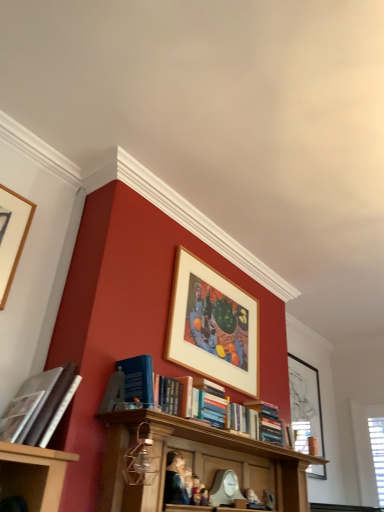
Question: Considering the relative positions of black matte picture frame at upper right, which ranks as the third picture frame in left-to-right order, and smooth plastic figurine at center, positioned as the 2th person in left-to-right order, in the image provided, is black matte picture frame at upper right, which ranks as the third picture frame in left-to-right order, to the right of smooth plastic figurine at center, positioned as the 2th person in left-to-right order, from the viewer's perspective?

Choices:
 (A) no
 (B) yes

Answer: (B)

Question: Is black matte picture frame at upper right, which is counted as the 1th picture frame, starting from the back, turned away from smooth plastic figurine at center, which appears as the first person when viewed from the right?

Choices:
 (A) yes
 (B) no

Answer: (B)

Question: Is black matte picture frame at upper right, which ranks as the 1th picture frame in right-to-left order, bigger than smooth plastic figurine at center, which appears as the first person when viewed from the right?

Choices:
 (A) yes
 (B) no

Answer: (A)

Question: From the image's perspective, is black matte picture frame at upper right, which ranks as the third picture frame in left-to-right order, located beneath smooth plastic figurine at center, positioned as the 2th person in left-to-right order?

Choices:
 (A) no
 (B) yes

Answer: (B)

Question: From the image's perspective, is black matte picture frame at upper right, which is counted as the 1th picture frame, starting from the back, on top of smooth plastic figurine at center, which appears as the first person when viewed from the right?

Choices:
 (A) yes
 (B) no

Answer: (B)

Question: From the image's perspective, relative to smooth plastic figurine at center, which appears as the first person when viewed from the right, is hardcover book at center, arranged as the 2th book when viewed from the top, above or below?

Choices:
 (A) above
 (B) below

Answer: (A)

Question: Do you think hardcover book at center, the 1th book viewed from the right, is within smooth plastic figurine at center, positioned as the 2th person in left-to-right order, or outside of it?

Choices:
 (A) inside
 (B) outside

Answer: (B)

Question: In the image, is hardcover book at center, arranged as the 2th book when viewed from the front, positioned in front of or behind smooth plastic figurine at center, positioned as the 2th person in left-to-right order?

Choices:
 (A) front
 (B) behind

Answer: (B)

Question: Visually, is hardcover book at center, arranged as the 2th book when viewed from the top, positioned to the left or to the right of smooth plastic figurine at center, which appears as the first person when viewed from the right?

Choices:
 (A) right
 (B) left

Answer: (A)

Question: Is black matte picture frame at upper right, which appears as the first picture frame when ordered from the bottom, wider or thinner than smooth canvas portrait at center, positioned as the 2th person in right-to-left order?

Choices:
 (A) wide
 (B) thin

Answer: (B)

Question: Would you say black matte picture frame at upper right, which is counted as the 1th picture frame, starting from the back, is to the left or to the right of smooth canvas portrait at center, acting as the 1th person starting from the left, in the picture?

Choices:
 (A) right
 (B) left

Answer: (A)

Question: Looking at the image, does black matte picture frame at upper right, positioned as the 3th picture frame in front-to-back order, seem bigger or smaller compared to smooth canvas portrait at center, acting as the 1th person starting from the left?

Choices:
 (A) small
 (B) big

Answer: (B)

Question: From a real-world perspective, is black matte picture frame at upper right, which appears as the first picture frame when ordered from the bottom, above or below smooth canvas portrait at center, acting as the 1th person starting from the left?

Choices:
 (A) above
 (B) below

Answer: (A)

Question: Is hardcover book at left, which ranks as the first book in front-to-back order, inside or outside of smooth plastic figurine at center, positioned as the 2th person in left-to-right order?

Choices:
 (A) outside
 (B) inside

Answer: (A)

Question: Is point (33, 379) closer or farther from the camera than point (195, 487)?

Choices:
 (A) farther
 (B) closer

Answer: (B)